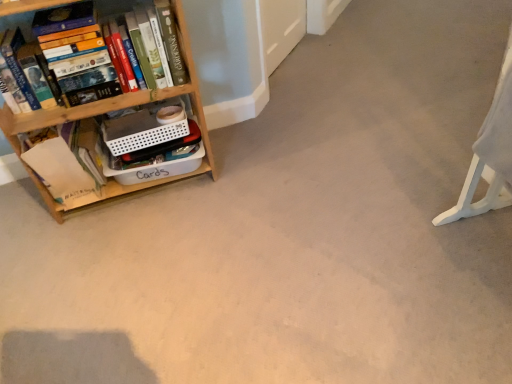
Question: Is white plastic swivel chair at right inside the boundaries of wooden bookshelf at left, or outside?

Choices:
 (A) inside
 (B) outside

Answer: (B)

Question: Considering the positions of point (480, 201) and point (153, 91), is point (480, 201) closer or farther from the camera than point (153, 91)?

Choices:
 (A) farther
 (B) closer

Answer: (B)

Question: Which is farther from the hardcover book at left?

Choices:
 (A) white plastic swivel chair at right
 (B) wooden bookshelf at left
 (C) white paper at left

Answer: (A)

Question: Which of these objects is positioned farthest from the white paper at left?

Choices:
 (A) hardcover book at left
 (B) wooden bookshelf at left
 (C) white plastic swivel chair at right

Answer: (C)